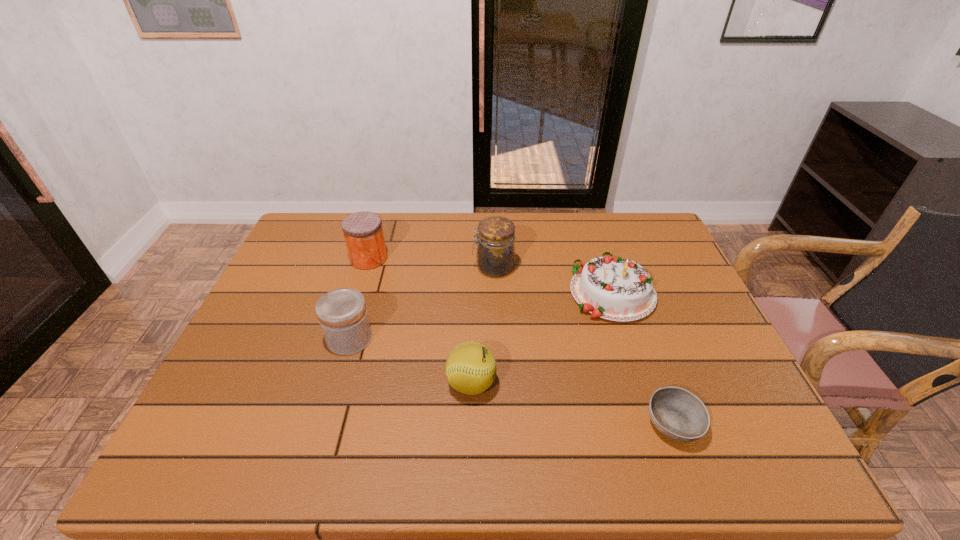
This screenshot has height=540, width=960. What are the coordinates of `object that stands as the third closest to the bowl` in the screenshot? It's located at (495, 255).

Select which object appears as the fifth closest to the rightmost jar. Please provide its 2D coordinates. Your answer should be formatted as a tuple, i.e. [(x, y)], where the tuple contains the x and y coordinates of a point satisfying the conditions above.

[(676, 413)]

The width and height of the screenshot is (960, 540). Find the location of `the closest jar to the cake`. the closest jar to the cake is located at coordinates (495, 255).

Select which jar appears as the third closest to the softball. Please provide its 2D coordinates. Your answer should be formatted as a tuple, i.e. [(x, y)], where the tuple contains the x and y coordinates of a point satisfying the conditions above.

[(363, 232)]

Locate an element on the screen. This screenshot has height=540, width=960. free space that satisfies the following two spatial constraints: 1. on the lid of the bowl; 2. on the right side of the rightmost jar is located at coordinates (499, 424).